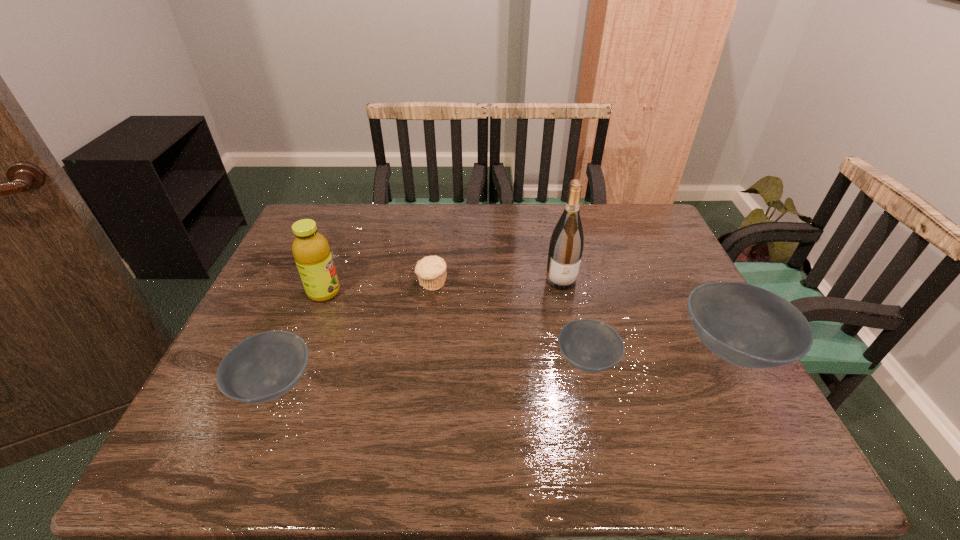
To ensure equal spacing by inserting another bowl among them, please point out a vacant spot for this new bowl. Please provide its 2D coordinates. Your answer should be formatted as a tuple, i.e. [(x, y)], where the tuple contains the x and y coordinates of a point satisfying the conditions above.

[(435, 372)]